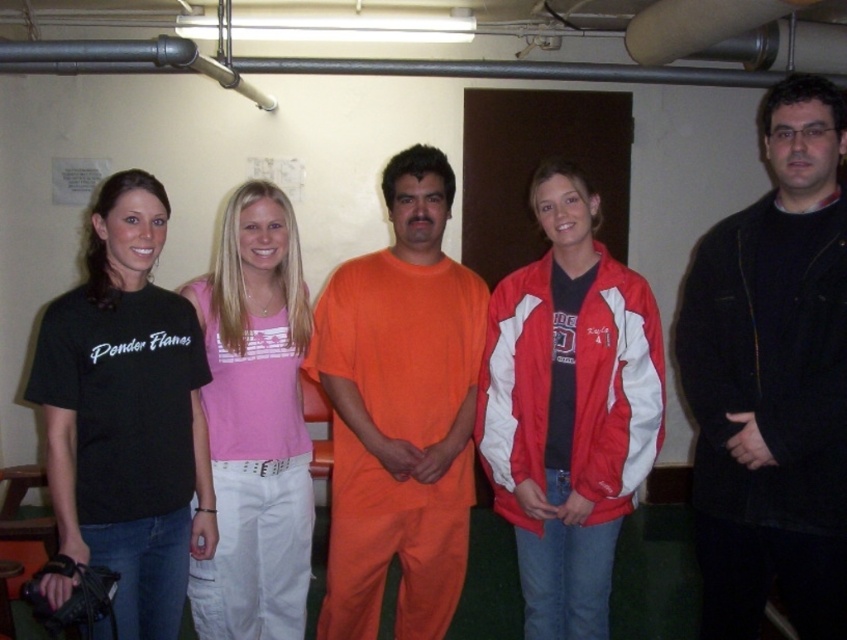
You are trying to determine the order of the people from front to back. Based on the image, which clothing item is closer to you between the red and white jacket at center and the pink fabric tank top at center?

The red and white jacket at center is in front of the pink fabric tank top at center, so the red and white jacket at center is closer to you.

You are standing in the basement and want to determine which of the two points, point (844, 128) or point (363, 324), is closer to you. Based on the image, which point is nearer?

Point (844, 128) is closer to the camera than point (363, 324), so it is the nearer one.

You are organizing a clothing donation drive and need to determine which item takes up more space in the donation box. Based on the image provided, which clothing item is wider between the red and white jacket at center and the pink fabric tank top at center?

The red and white jacket at center is wider than the pink fabric tank top at center according to the description.